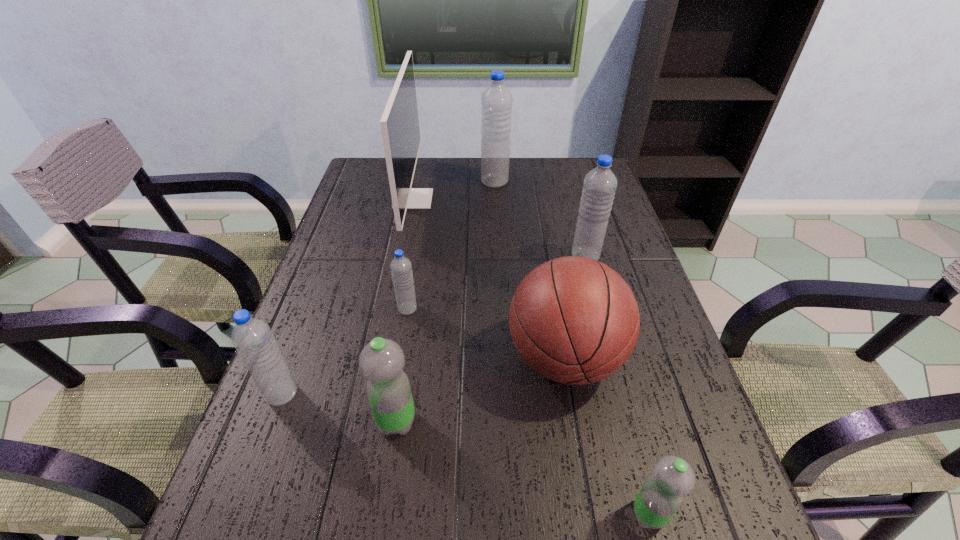
At what (x,y) coordinates should I click in order to perform the action: click on free point that satisfies the following two spatial constraints: 1. on the back side of the basketball; 2. on the left side of the bigger green water bottle. Please return your answer as a coordinate pair (x, y). Image resolution: width=960 pixels, height=540 pixels. Looking at the image, I should click on (406, 359).

Identify the location of free location that satisfies the following two spatial constraints: 1. on the back side of the right green water bottle; 2. on the front-facing side of the black monitor. (566, 199).

At what (x,y) coordinates should I click in order to perform the action: click on free space that satisfies the following two spatial constraints: 1. on the front side of the farthest blue water bottle; 2. on the front-facing side of the black monitor. Please return your answer as a coordinate pair (x, y). The height and width of the screenshot is (540, 960). Looking at the image, I should click on (495, 199).